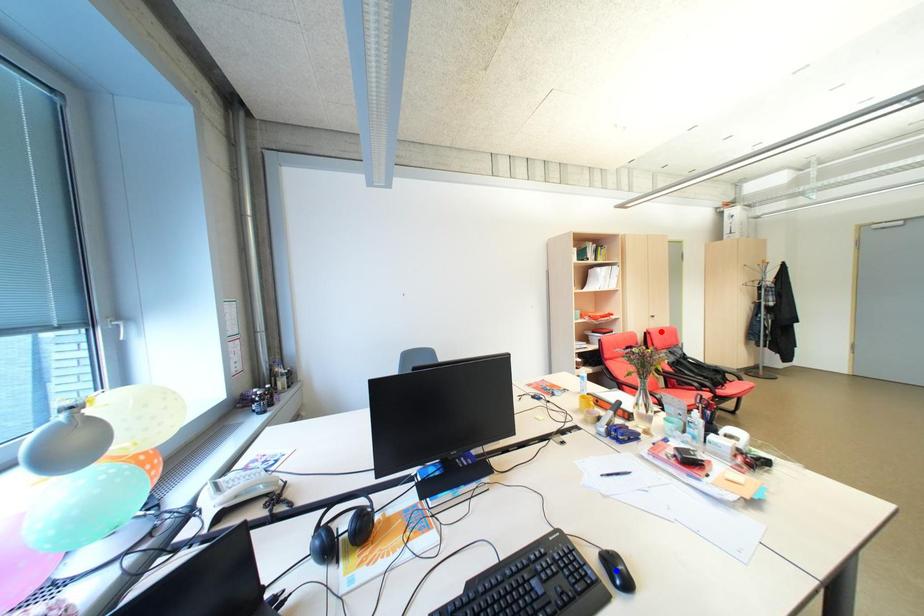
Question: Two points are marked on the image. Which point is closer to the camera?

Choices:
 (A) Blue point is closer.
 (B) Red point is closer.

Answer: (A)